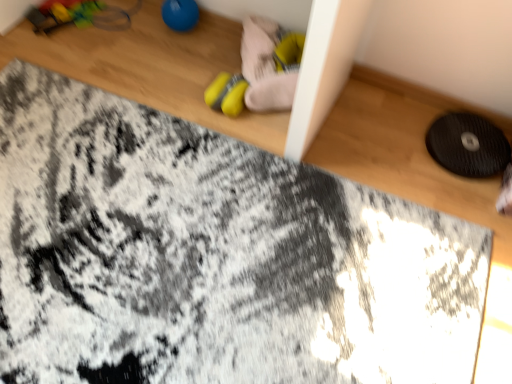
Question: Does yellow fabric shoe at upper center appear on the right side of blue rubber ball at upper center, arranged as the 2th toy when viewed from the right?

Choices:
 (A) yes
 (B) no

Answer: (A)

Question: Does yellow fabric shoe at upper center have a lesser width compared to blue rubber ball at upper center, the first toy in the left-to-right sequence?

Choices:
 (A) yes
 (B) no

Answer: (B)

Question: Would you say yellow fabric shoe at upper center contains blue rubber ball at upper center, arranged as the 2th toy when viewed from the right?

Choices:
 (A) no
 (B) yes

Answer: (A)

Question: Are yellow fabric shoe at upper center and blue rubber ball at upper center, the first toy in the left-to-right sequence, far apart?

Choices:
 (A) no
 (B) yes

Answer: (A)

Question: Is yellow fabric shoe at upper center smaller than blue rubber ball at upper center, arranged as the 2th toy when viewed from the right?

Choices:
 (A) no
 (B) yes

Answer: (B)

Question: Is black textured mat at right to the left or to the right of blue rubber ball at upper center, arranged as the 2th toy when viewed from the right, in the image?

Choices:
 (A) left
 (B) right

Answer: (B)

Question: Does point (463, 145) appear closer or farther from the camera than point (161, 16)?

Choices:
 (A) closer
 (B) farther

Answer: (A)

Question: Would you say black textured mat at right is inside or outside blue rubber ball at upper center, the first toy in the left-to-right sequence?

Choices:
 (A) inside
 (B) outside

Answer: (B)

Question: From the image's perspective, is black textured mat at right located above or below blue rubber ball at upper center, arranged as the 2th toy when viewed from the right?

Choices:
 (A) below
 (B) above

Answer: (A)

Question: From the image's perspective, relative to yellow rubber toy at center, arranged as the first toy when viewed from the right, is black textured mat at right above or below?

Choices:
 (A) above
 (B) below

Answer: (B)

Question: Choose the correct answer: Is black textured mat at right inside yellow rubber toy at center, the 2th toy in the left-to-right sequence, or outside it?

Choices:
 (A) inside
 (B) outside

Answer: (B)

Question: From a real-world perspective, is black textured mat at right above or below yellow rubber toy at center, arranged as the first toy when viewed from the right?

Choices:
 (A) below
 (B) above

Answer: (A)

Question: Visually, is black textured mat at right positioned to the left or to the right of yellow rubber toy at center, the 2th toy in the left-to-right sequence?

Choices:
 (A) left
 (B) right

Answer: (B)

Question: In terms of height, does blue rubber ball at upper center, the first toy in the left-to-right sequence, look taller or shorter compared to black textured mat at right?

Choices:
 (A) short
 (B) tall

Answer: (B)

Question: In terms of width, does blue rubber ball at upper center, arranged as the 2th toy when viewed from the right, look wider or thinner when compared to black textured mat at right?

Choices:
 (A) thin
 (B) wide

Answer: (A)